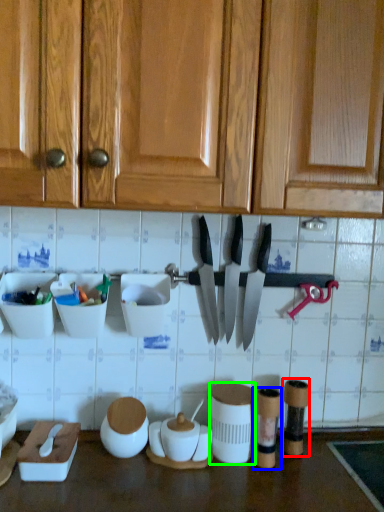
Question: Based on their relative distances, which object is nearer to tableware (highlighted by a red box)? Choose from tableware (highlighted by a blue box) and tableware (highlighted by a green box).

Choices:
 (A) tableware
 (B) tableware

Answer: (A)